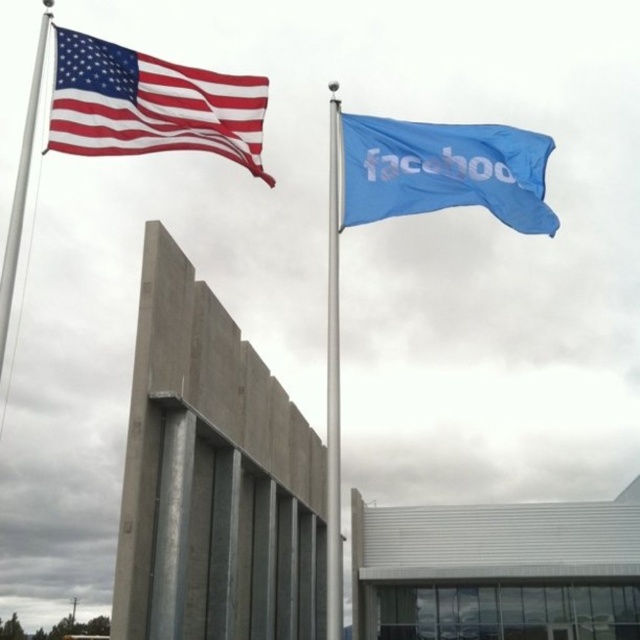
Question: Is red-white-striped fabric flag at upper left smaller than metallic silver flag pole at center?

Choices:
 (A) no
 (B) yes

Answer: (B)

Question: Which point is farther to the camera?

Choices:
 (A) red-white-striped fabric flag at upper left
 (B) blue fabric flag at upper right
 (C) polished metal flag pole at left

Answer: (B)

Question: Is the position of blue fabric flag at upper right more distant than that of polished metal flag pole at left?

Choices:
 (A) no
 (B) yes

Answer: (B)

Question: Which object is the closest to the metallic silver flag pole at center?

Choices:
 (A) polished metal flag pole at left
 (B) red-white-striped fabric flag at upper left
 (C) blue fabric flag at upper right

Answer: (C)

Question: Based on their relative distances, which object is farther from the red-white-striped fabric flag at upper left?

Choices:
 (A) metallic silver flag pole at center
 (B) polished metal flag pole at left
 (C) blue fabric flag at upper right

Answer: (A)

Question: Can you confirm if red-white-striped fabric flag at upper left is bigger than polished metal flag pole at left?

Choices:
 (A) yes
 (B) no

Answer: (B)